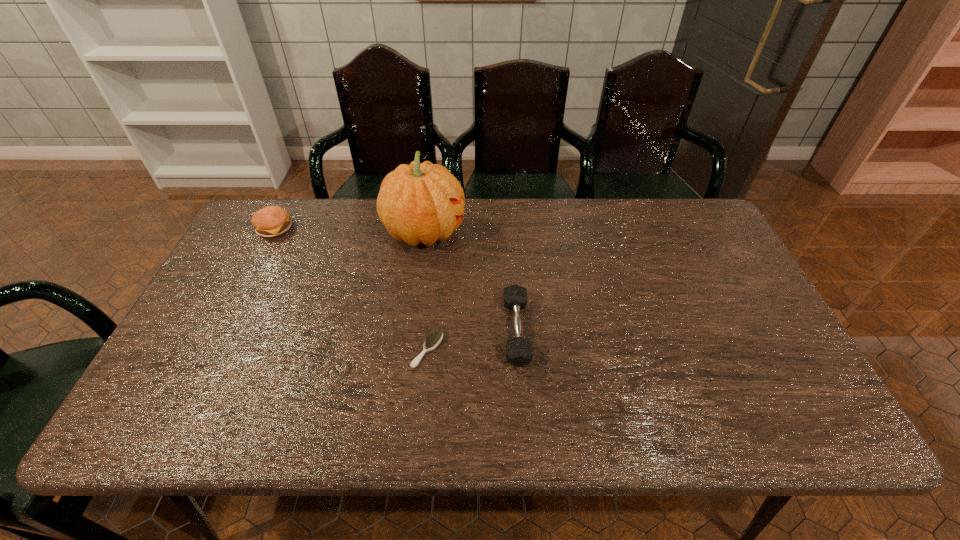
The height and width of the screenshot is (540, 960). Identify the location of object that is positioned at the left edge. click(271, 221).

This screenshot has height=540, width=960. Find the location of `object positioned at the far left corner`. object positioned at the far left corner is located at coordinates (271, 221).

Image resolution: width=960 pixels, height=540 pixels. In the image, there is a desktop. What are the coordinates of `free region at the far edge` in the screenshot? It's located at (569, 219).

The height and width of the screenshot is (540, 960). I want to click on vacant space at the near edge of the desktop, so click(x=269, y=427).

Where is `vacant space at the left edge of the desktop`? vacant space at the left edge of the desktop is located at coordinates (195, 392).

Image resolution: width=960 pixels, height=540 pixels. What are the coordinates of `vacant space at the right edge` in the screenshot? It's located at (745, 370).

Locate an element on the screen. The width and height of the screenshot is (960, 540). vacant region at the far left corner of the desktop is located at coordinates (244, 238).

The image size is (960, 540). Identify the location of free space at the near left corner. (190, 413).

The image size is (960, 540). I want to click on free space at the far right corner, so click(707, 218).

Find the location of a particular element. This screenshot has width=960, height=540. free space between the rightmost object and the scrubbing brush is located at coordinates (471, 340).